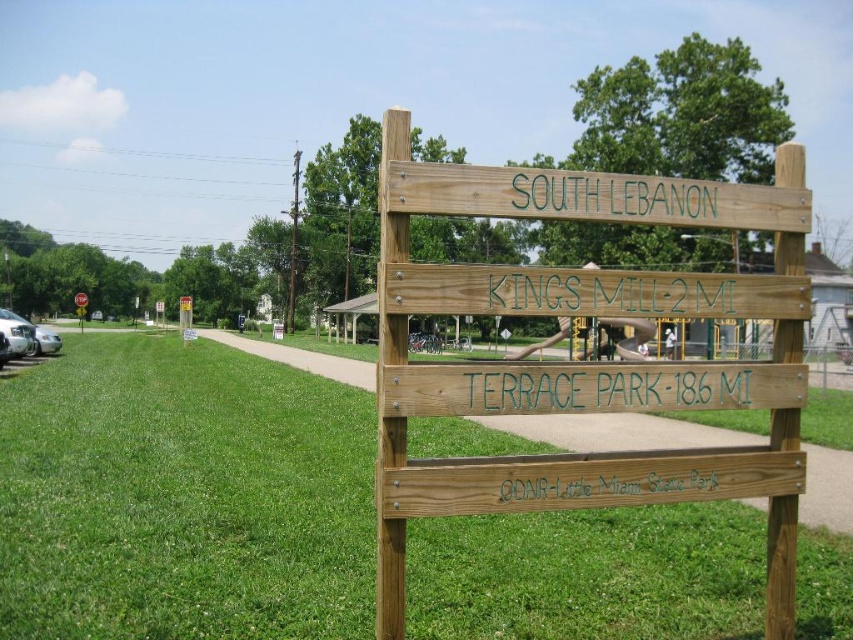
Is green painted sign at center above green wood sign at upper center?

No, green painted sign at center is not above green wood sign at upper center.

Is green painted sign at center taller than green wood sign at upper center?

Incorrect, green painted sign at center's height is not larger of green wood sign at upper center's.

At what (x,y) coordinates should I click in order to perform the action: click on green painted sign at center. Please return your answer as a coordinate pair (x, y). The width and height of the screenshot is (853, 640). Looking at the image, I should click on (605, 387).

Locate an element on the screen. This screenshot has width=853, height=640. green painted sign at center is located at coordinates click(x=605, y=387).

Is point (633, 572) positioned after point (78, 310)?

No, (633, 572) is in front of (78, 310).

Based on the photo, can you confirm if green grass at center is positioned to the left of metallic yellow stop sign at upper left?

Incorrect, green grass at center is not on the left side of metallic yellow stop sign at upper left.

The height and width of the screenshot is (640, 853). I want to click on green grass at center, so click(x=183, y=497).

Based on the photo, between green wood sign at upper center and metallic yellow stop sign at upper left, which one has less height?

green wood sign at upper center

Consider the image. Between green wood sign at upper center and metallic yellow stop sign at upper left, which one appears on the right side from the viewer's perspective?

Positioned to the right is green wood sign at upper center.

What do you see at coordinates (612, 196) in the screenshot? I see `green wood sign at upper center` at bounding box center [612, 196].

The image size is (853, 640). Identify the location of green wood sign at upper center. (612, 196).